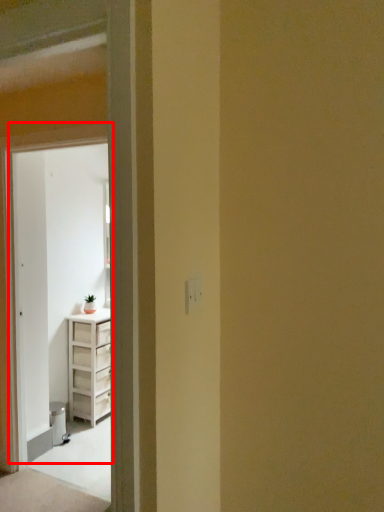
Question: Considering the relative positions of door (annotated by the red box) and screen door in the image provided, where is door (annotated by the red box) located with respect to the staircase?

Choices:
 (A) right
 (B) left

Answer: (A)